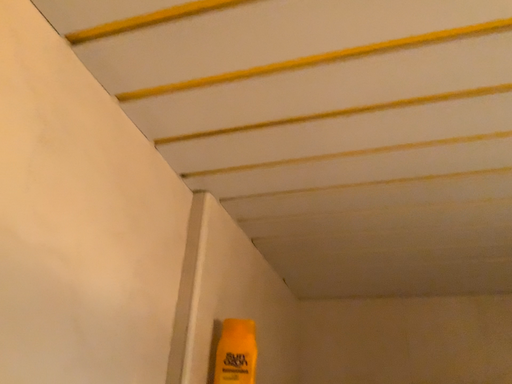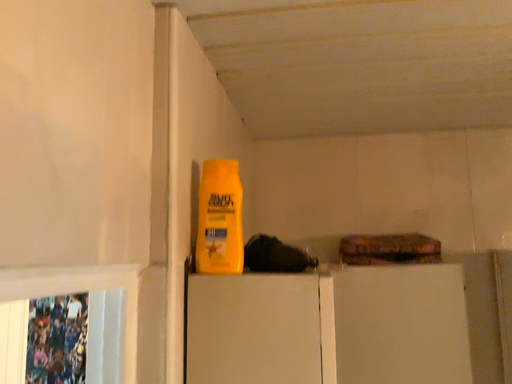
Question: How did the camera likely rotate when shooting the video?

Choices:
 (A) rotated right
 (B) rotated left

Answer: (A)